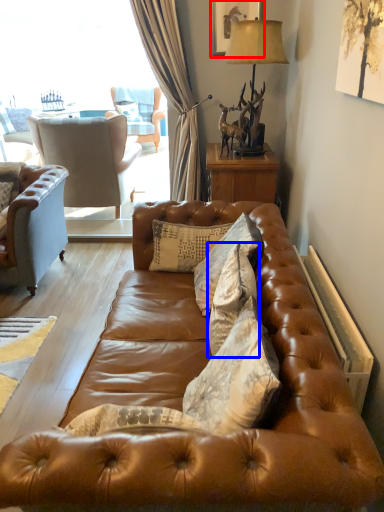
Question: Which object is closer to the camera taking this photo, picture frame (highlighted by a red box) or pillow (highlighted by a blue box)?

Choices:
 (A) picture frame
 (B) pillow

Answer: (B)